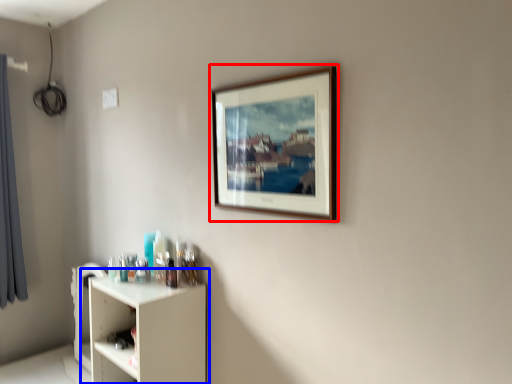
Question: Which of the following is the closest to the observer, picture frame (highlighted by a red box) or shelf (highlighted by a blue box)?

Choices:
 (A) picture frame
 (B) shelf

Answer: (A)